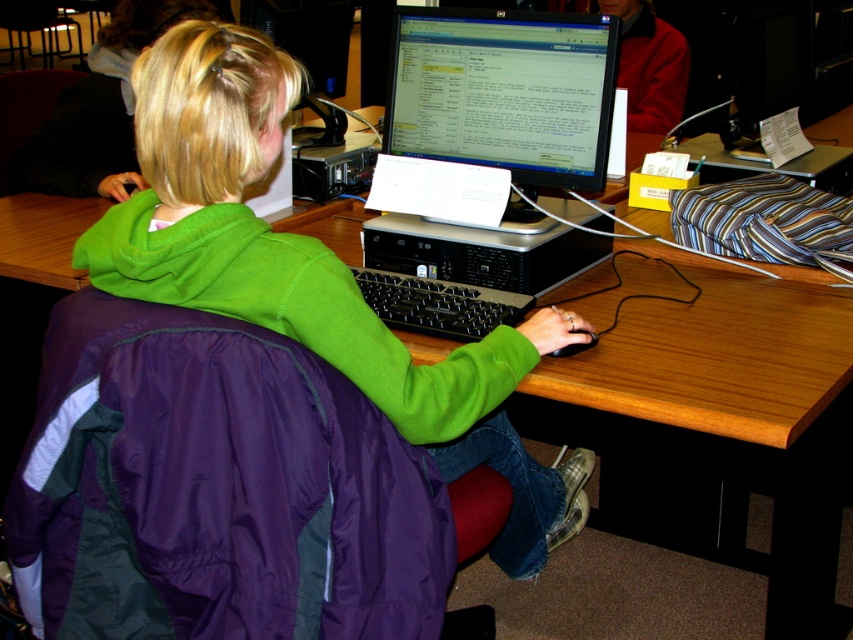
What do you see at coordinates (503, 92) in the screenshot? I see `matte black monitor at center` at bounding box center [503, 92].

Is matte black monitor at center positioned at the back of black plastic computer at center?

No, it is not.

Who is more distant from viewer, (527, 106) or (535, 248)?

Point (527, 106)

This screenshot has width=853, height=640. What are the coordinates of `matte black monitor at center` in the screenshot? It's located at (503, 92).

Which is below, red jacket at upper right or black matte mouse at lower center?

black matte mouse at lower center is lower down.

Does red jacket at upper right appear on the right side of black matte mouse at lower center?

Indeed, red jacket at upper right is positioned on the right side of black matte mouse at lower center.

Between point (618, 4) and point (558, 349), which one is positioned behind?

Point (618, 4)

I want to click on red jacket at upper right, so click(648, 65).

Which is below, purple nylon jacket at center or green fleece sweatshirt at center?

Positioned lower is purple nylon jacket at center.

Which is behind, point (296, 630) or point (503, 336)?

Positioned behind is point (503, 336).

Image resolution: width=853 pixels, height=640 pixels. What are the coordinates of `purple nylon jacket at center` in the screenshot? It's located at (216, 488).